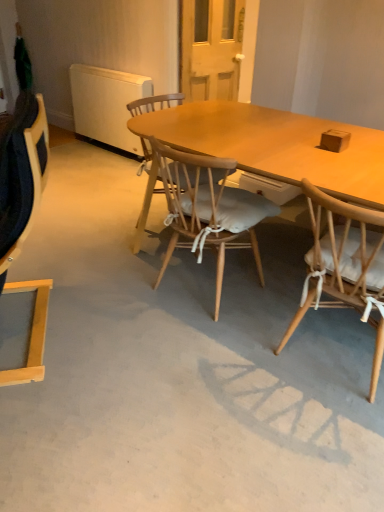
What are the coordinates of `free area in between light wood chair at left, placed as the first chair when sorted from left to right, and wooden chair with white cushion at right, placed as the 1th chair when sorted from right to left` in the screenshot? It's located at pyautogui.click(x=182, y=347).